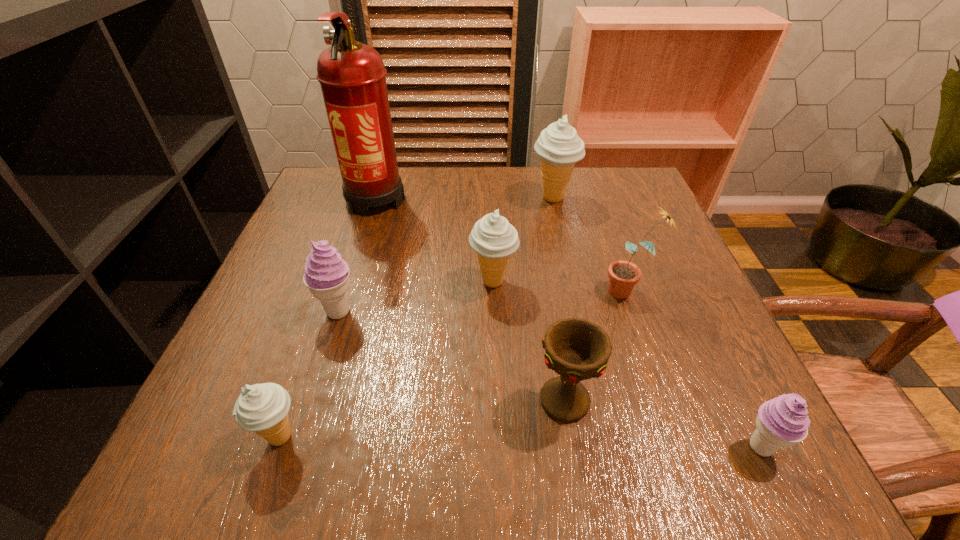
The height and width of the screenshot is (540, 960). In order to click on the smallest beige icecream in this screenshot , I will do `click(263, 408)`.

Where is `the leftmost beige icecream`? This screenshot has height=540, width=960. the leftmost beige icecream is located at coordinates (263, 408).

The height and width of the screenshot is (540, 960). I want to click on the right purple icecream, so 781,422.

You are a GUI agent. You are given a task and a screenshot of the screen. Output one action in this format:
    pyautogui.click(x=<x>, y=<y>)
    Task: Click on the nearer purple icecream
    This screenshot has width=960, height=540.
    Given the screenshot: What is the action you would take?
    pyautogui.click(x=781, y=422)

You are a GUI agent. You are given a task and a screenshot of the screen. Output one action in this format:
    pyautogui.click(x=<x>, y=<y>)
    Task: Click on the vacant point located 0.230m on the front-facing side of the fire extinguisher
    
    Given the screenshot: What is the action you would take?
    pyautogui.click(x=345, y=297)

Identify the location of vacant space located 0.170m on the right of the farthest icecream. The width and height of the screenshot is (960, 540). (644, 198).

You are a GUI agent. You are given a task and a screenshot of the screen. Output one action in this format:
    pyautogui.click(x=<x>, y=<y>)
    Task: Click on the vacant area situated 0.140m on the flower of the sunflower
    The image size is (960, 540).
    Given the screenshot: What is the action you would take?
    pyautogui.click(x=533, y=291)

Where is `vacant region located 0.350m on the flower of the sunflower`? Image resolution: width=960 pixels, height=540 pixels. vacant region located 0.350m on the flower of the sunflower is located at coordinates (426, 291).

At what (x,y) coordinates should I click in order to perform the action: click on vacant area located 0.050m on the flower of the sunflower. Please return your answer as a coordinate pair (x, y). This screenshot has height=540, width=960. Looking at the image, I should click on (578, 291).

You are a GUI agent. You are given a task and a screenshot of the screen. Output one action in this format:
    pyautogui.click(x=<x>, y=<y>)
    Task: Click on the free space located 0.240m on the front of the third icecream from left to right
    
    Given the screenshot: What is the action you would take?
    coord(497,410)